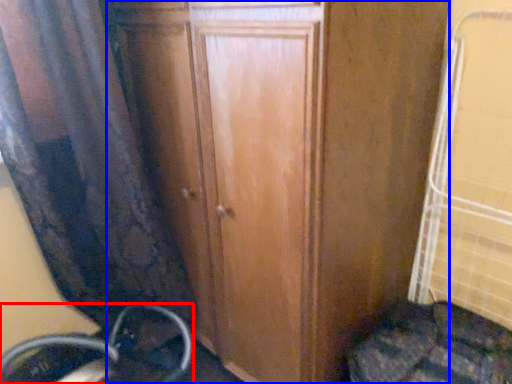
Question: Which of the following is the closest to the observer, wheel (highlighted by a red box) or door (highlighted by a blue box)?

Choices:
 (A) wheel
 (B) door

Answer: (B)